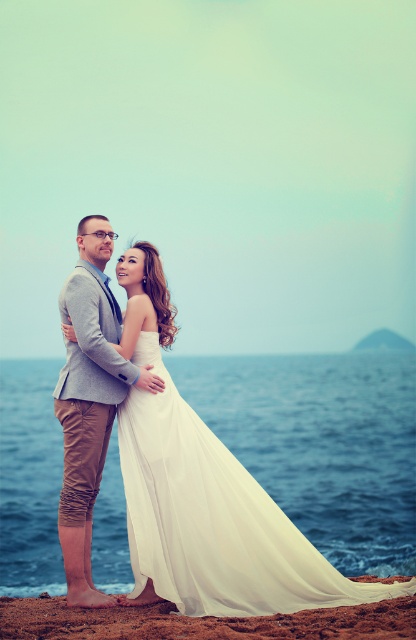
Between point (126, 360) and point (155, 637), which one is positioned in front?

Positioned in front is point (155, 637).

Can you confirm if light gray textured blazer at center is taller than brown sand at lower center?

Yes, light gray textured blazer at center is taller than brown sand at lower center.

Who is more forward, (81, 572) or (341, 611)?

Positioned in front is point (341, 611).

This screenshot has width=416, height=640. Find the location of `light gray textured blazer at center`. light gray textured blazer at center is located at coordinates (89, 401).

Which is more to the right, white chiffon dress at center or brown sand at lower center?

From the viewer's perspective, white chiffon dress at center appears more on the right side.

Between point (208, 570) and point (410, 600), which one is positioned in front?

Point (410, 600) is more forward.

Between point (188, 589) and point (337, 608), which one is positioned in front?

Positioned in front is point (337, 608).

The image size is (416, 640). I want to click on white chiffon dress at center, so click(x=212, y=518).

Is white chiffon dress at center behind light gray textured blazer at center?

No, white chiffon dress at center is in front of light gray textured blazer at center.

Does white chiffon dress at center have a smaller size compared to light gray textured blazer at center?

No, white chiffon dress at center is not smaller than light gray textured blazer at center.

Does point (161, 360) lie in front of point (69, 589)?

No, it is not.

Identify the location of white chiffon dress at center. (212, 518).